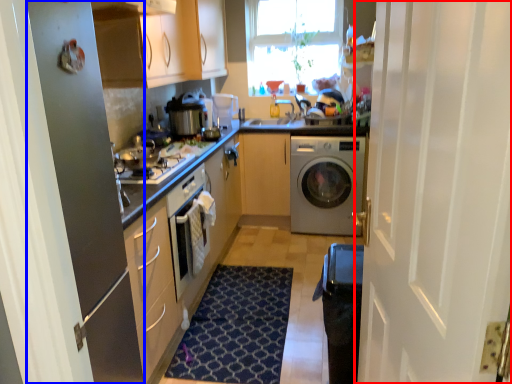
Question: Among these objects, which one is farthest to the camera, door (highlighted by a red box) or screen door (highlighted by a blue box)?

Choices:
 (A) door
 (B) screen door

Answer: (B)